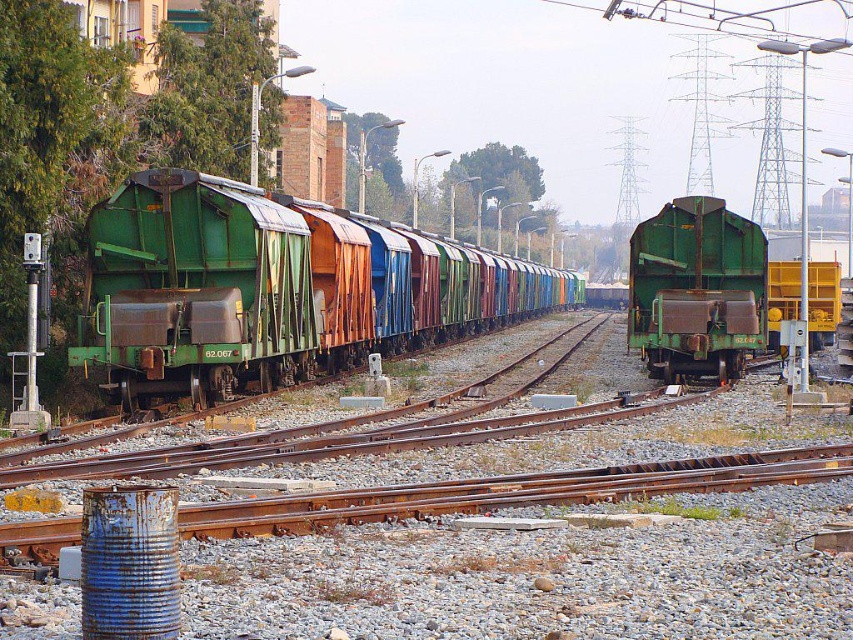
Is green matte train carriages at center wider than green matte train car at center?

Correct, the width of green matte train carriages at center exceeds that of green matte train car at center.

Between point (566, 292) and point (682, 353), which one is positioned in front?

Point (682, 353) is more forward.

Which is behind, point (462, 280) or point (747, 284)?

The point (462, 280) is behind.

Identify the location of green matte train carriages at center. The height and width of the screenshot is (640, 853). (271, 289).